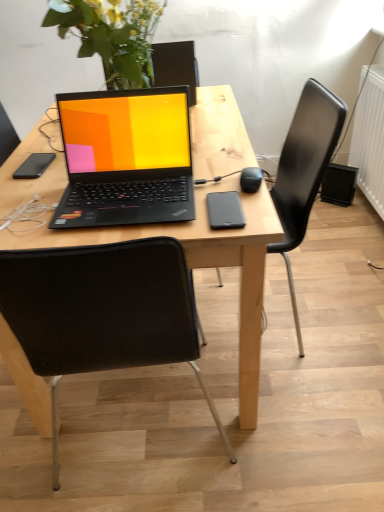
What are the coordinates of `free space in front of black plastic chair at center, positioned as the first chair in right-to-left order` in the screenshot? It's located at [x=313, y=403].